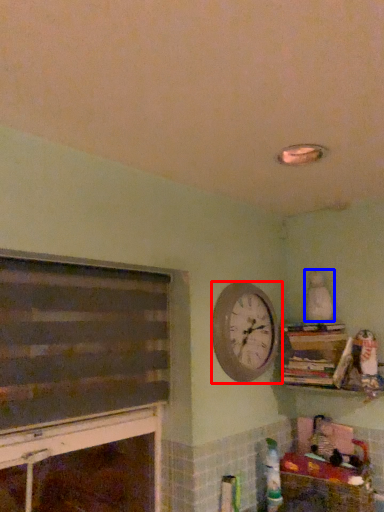
Question: Which point is closer to the camera, wall clock (highlighted by a red box) or toy (highlighted by a blue box)?

Choices:
 (A) wall clock
 (B) toy

Answer: (A)